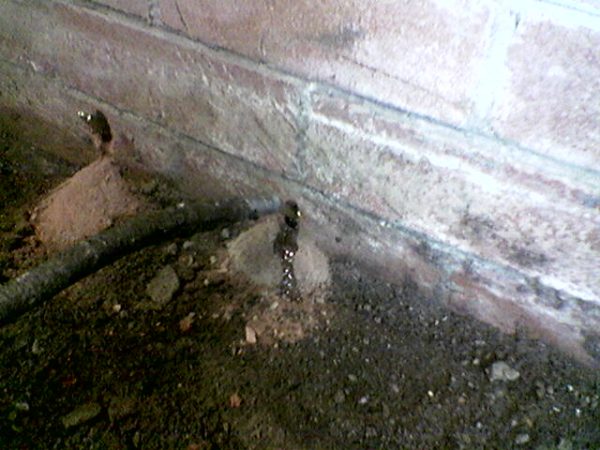
Find the location of a particular element. Image resolution: width=600 pixels, height=450 pixels. wall is located at coordinates (400, 137).